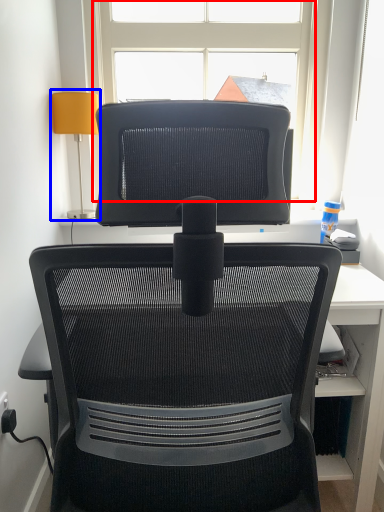
Question: Which object appears farthest to the camera in this image, window (highlighted by a red box) or table lamp (highlighted by a blue box)?

Choices:
 (A) window
 (B) table lamp

Answer: (A)